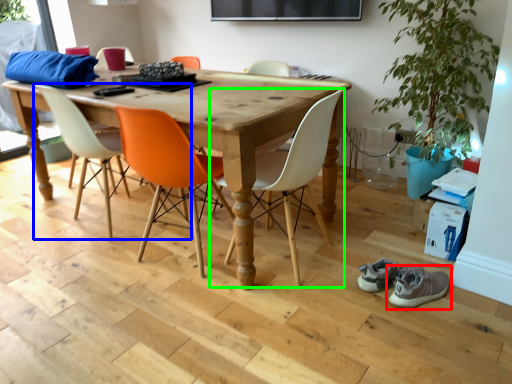
Question: Which object is positioned closest to footwear (highlighted by a red box)? Select from chair (highlighted by a blue box) and chair (highlighted by a green box).

Choices:
 (A) chair
 (B) chair

Answer: (B)